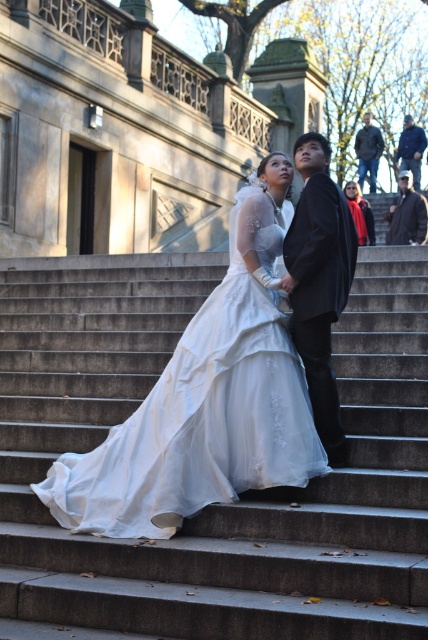
Is denim jacket at upper right taller than blue denim jacket at upper right?

No, denim jacket at upper right is not taller than blue denim jacket at upper right.

At what (x,y) coordinates should I click in order to perform the action: click on denim jacket at upper right. Please return your answer as a coordinate pair (x, y). This screenshot has width=428, height=640. Looking at the image, I should click on (368, 150).

Image resolution: width=428 pixels, height=640 pixels. Identify the location of denim jacket at upper right. (368, 150).

You are a GUI agent. You are given a task and a screenshot of the screen. Output one action in this format:
    pyautogui.click(x=<x>, y=<y>)
    Task: Click on the denim jacket at upper right
    
    Given the screenshot: What is the action you would take?
    pyautogui.click(x=368, y=150)

Between point (287, 211) and point (376, 176), which one is positioned behind?

The point (376, 176) is behind.

The image size is (428, 640). Describe the element at coordinates (204, 410) in the screenshot. I see `white satin dress at center` at that location.

Which is behind, point (281, 234) or point (368, 141)?

Positioned behind is point (368, 141).

Find the location of a particular element. This screenshot has width=428, height=640. white satin dress at center is located at coordinates (204, 410).

Between point (425, 145) and point (356, 189), which one is positioned in front?

Point (356, 189) is in front.

Is blue denim jacket at upper right above red scarf at upper right?

Correct, blue denim jacket at upper right is located above red scarf at upper right.

The width and height of the screenshot is (428, 640). Identify the location of blue denim jacket at upper right. (410, 148).

Identify the location of blue denim jacket at upper right. The image size is (428, 640). (410, 148).